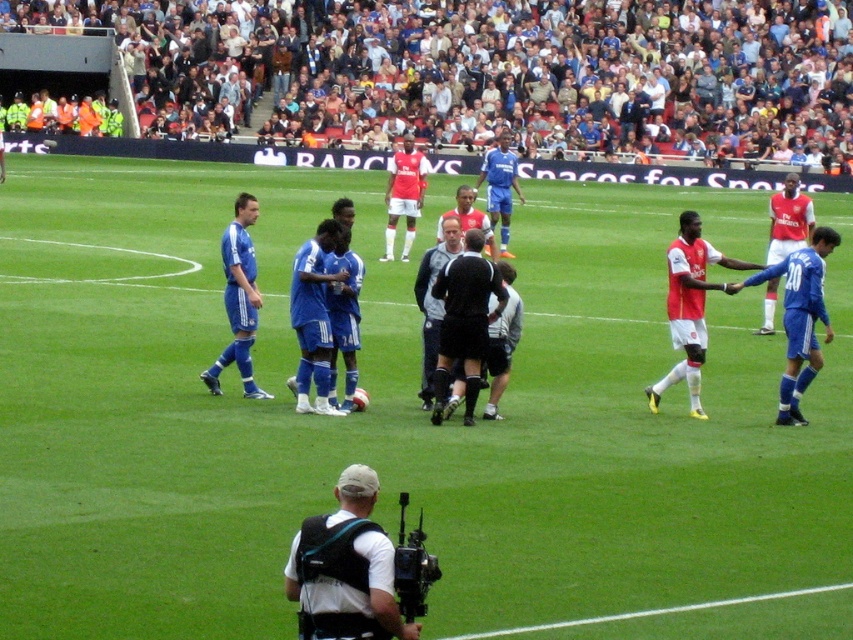
Question: Is blue fabric soccer players at center to the left of black uniformed official at center from the viewer's perspective?

Choices:
 (A) no
 (B) yes

Answer: (A)

Question: Which of these objects is positioned closest to the black uniformed official at center?

Choices:
 (A) matte white shorts at center
 (B) matte red jersey at center

Answer: (B)

Question: Which of the following is the farthest from the observer?

Choices:
 (A) black uniformed official at center
 (B) matte white shorts at center

Answer: (B)

Question: Is the position of white fabric camera at center less distant than that of matte red jersey at center?

Choices:
 (A) no
 (B) yes

Answer: (B)

Question: Does multicolored fabric crowd at upper center have a smaller size compared to matte red jersey at center?

Choices:
 (A) no
 (B) yes

Answer: (A)

Question: Among these points, which one is farthest from the camera?

Choices:
 (A) (285, 572)
 (B) (223, 236)

Answer: (B)